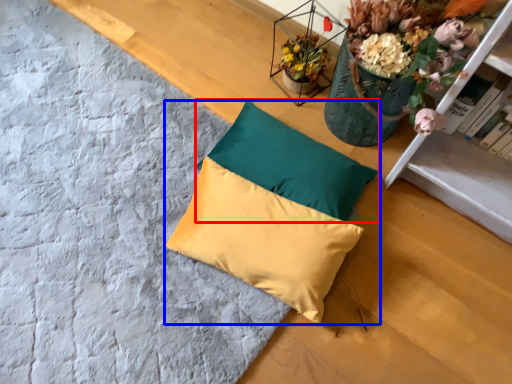
Question: Which of the following is the farthest to the observer, pillow (highlighted by a red box) or pillow (highlighted by a blue box)?

Choices:
 (A) pillow
 (B) pillow

Answer: (A)